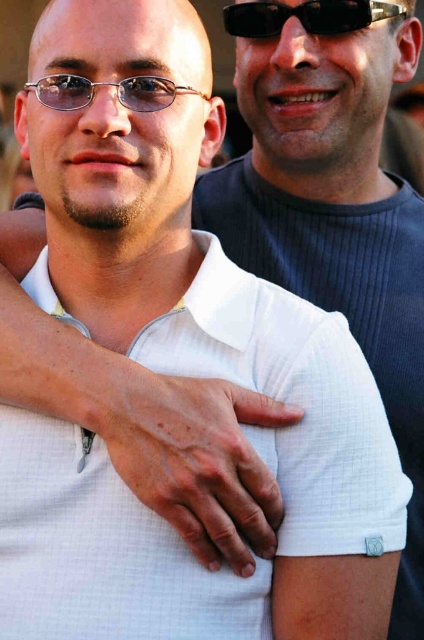
Question: Which point is closer to the camera?

Choices:
 (A) white mesh shirt at center
 (B) black plastic sunglasses at upper center

Answer: (A)

Question: From the image, what is the correct spatial relationship of white mesh shirt at center in relation to black plastic sunglasses at upper center?

Choices:
 (A) right
 (B) left

Answer: (B)

Question: Is white mesh shirt at center to the left of matte metal glasses at center from the viewer's perspective?

Choices:
 (A) no
 (B) yes

Answer: (A)

Question: Does white mesh shirt at center appear over matte metal glasses at center?

Choices:
 (A) no
 (B) yes

Answer: (A)

Question: Which point appears closest to the camera in this image?

Choices:
 (A) (39, 83)
 (B) (24, 358)

Answer: (B)

Question: Which point is closer to the camera taking this photo?

Choices:
 (A) (234, 6)
 (B) (145, 86)
 (C) (204, 563)

Answer: (C)